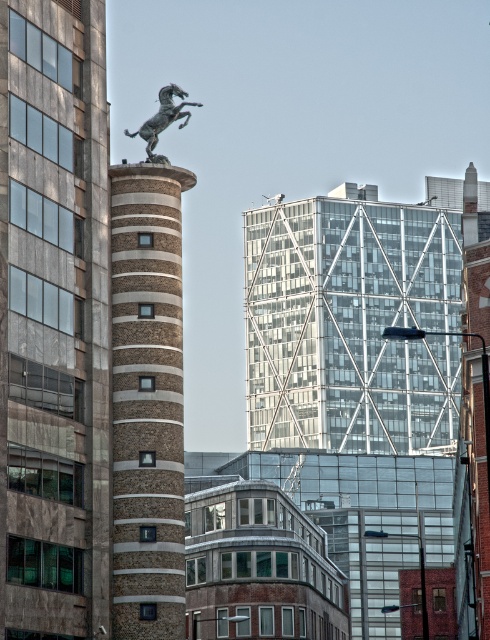
Question: Which point appears farthest from the camera in this image?

Choices:
 (A) (86, 435)
 (B) (170, 86)

Answer: (B)

Question: Which point appears closest to the camera in this image?

Choices:
 (A) coord(263,308)
 (B) coord(91,163)
 (C) coord(118,513)

Answer: (B)

Question: Which object appears closest to the camera in this image?

Choices:
 (A) bronze horse at upper center
 (B) brown textured column at center-left
 (C) brown brick tower at center
 (D) transparent glass building at center

Answer: (B)

Question: Does brown textured column at center-left have a lesser width compared to bronze horse at upper center?

Choices:
 (A) yes
 (B) no

Answer: (A)

Question: Is transparent glass building at center in front of brown brick tower at center?

Choices:
 (A) no
 (B) yes

Answer: (A)

Question: Can you confirm if brown textured column at center-left is positioned below transparent glass building at center?

Choices:
 (A) yes
 (B) no

Answer: (A)